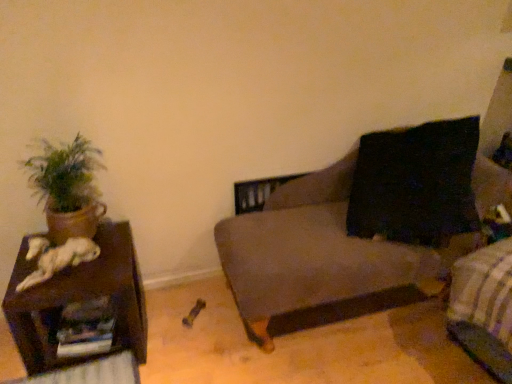
The height and width of the screenshot is (384, 512). In order to click on free area in between brown wooden side table at left and dark gray fabric couch at center in this screenshot , I will do `click(186, 330)`.